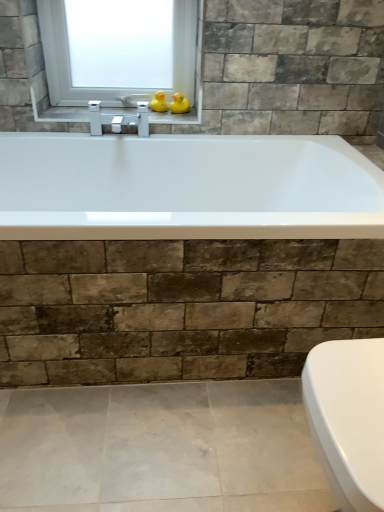
This screenshot has height=512, width=384. Find the location of `free space in front of yellow rubber duck at upper center, which is counted as the second duck, starting from the left`. free space in front of yellow rubber duck at upper center, which is counted as the second duck, starting from the left is located at coordinates (175, 120).